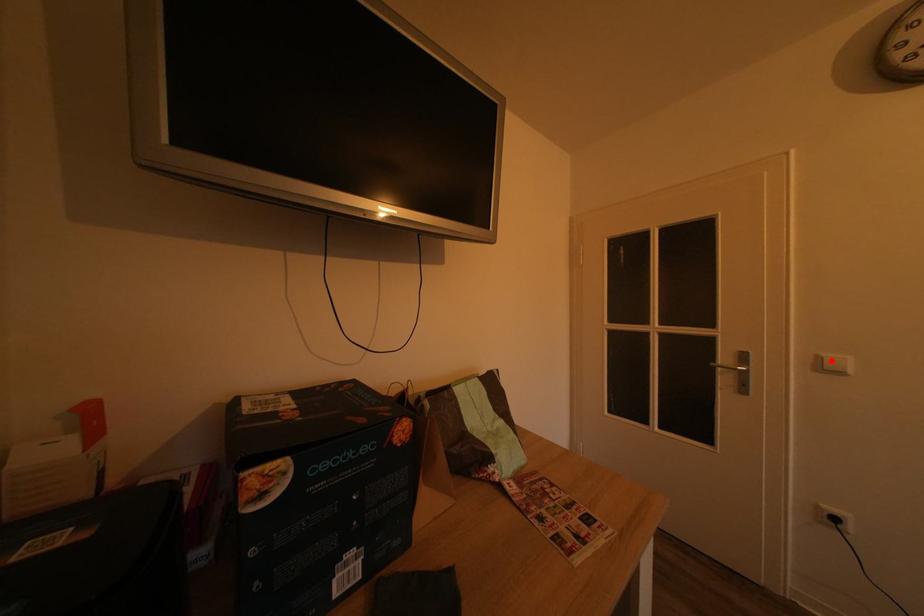
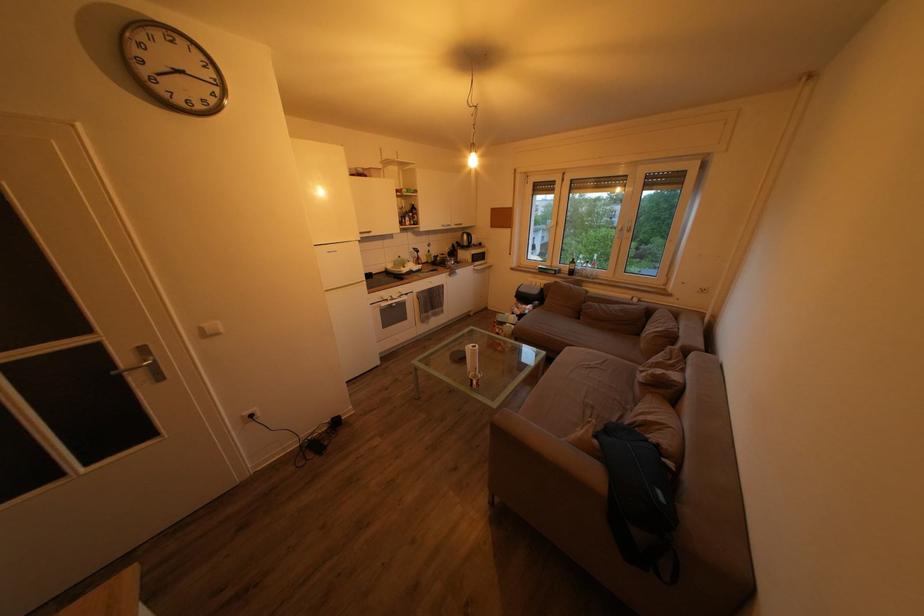
The point at the highlighted location is marked in the first image. Where is the corresponding point in the second image?

(211, 331)